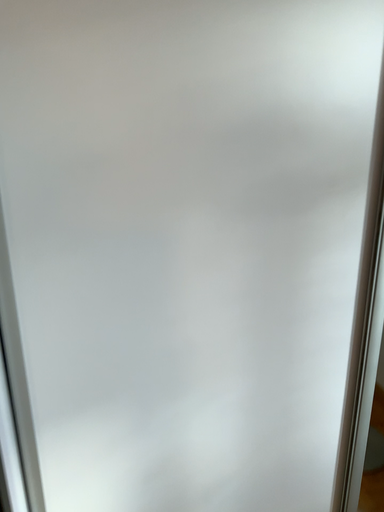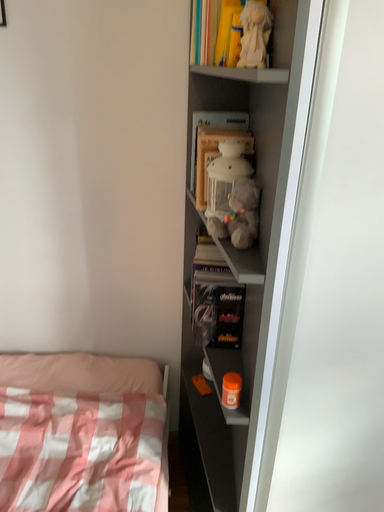
Question: How did the camera likely rotate when shooting the video?

Choices:
 (A) rotated left
 (B) rotated right

Answer: (A)